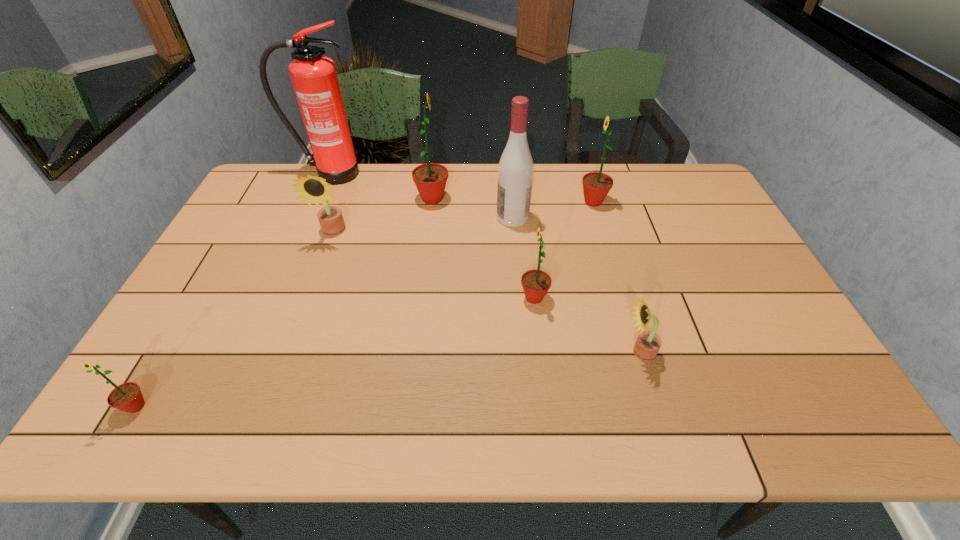
Identify which object is located as the third nearest to the alcohol. Please provide its 2D coordinates. Your answer should be formatted as a tuple, i.e. [(x, y)], where the tuple contains the x and y coordinates of a point satisfying the conditions above.

[(536, 283)]

The image size is (960, 540). Identify the location of sunflower that is the fourth closest one to the alcohol. (312, 188).

Where is `sunflower identified as the second closest to the fourth nearest sunflower`? The image size is (960, 540). sunflower identified as the second closest to the fourth nearest sunflower is located at coordinates click(536, 283).

Where is `green sunflower object that ranks as the second closest to the third sunflower from right to left`? green sunflower object that ranks as the second closest to the third sunflower from right to left is located at coordinates (430, 179).

The image size is (960, 540). I want to click on green sunflower that is the third closest one to the fourth object from left to right, so click(127, 397).

Where is `vacant space that satisfies the following two spatial constraints: 1. on the face of the fifth object from right to left; 2. on the face of the leftmost object`? The height and width of the screenshot is (540, 960). vacant space that satisfies the following two spatial constraints: 1. on the face of the fifth object from right to left; 2. on the face of the leftmost object is located at coordinates (406, 406).